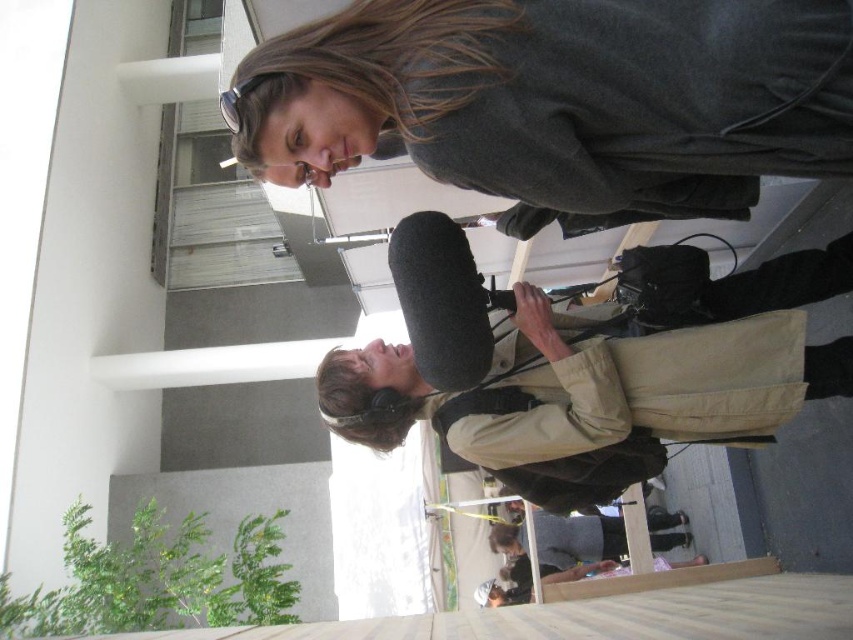
Is dark gray sweater at upper center shorter than beige fabric backpack at center?

Yes.

The image size is (853, 640). I want to click on dark gray sweater at upper center, so click(x=563, y=97).